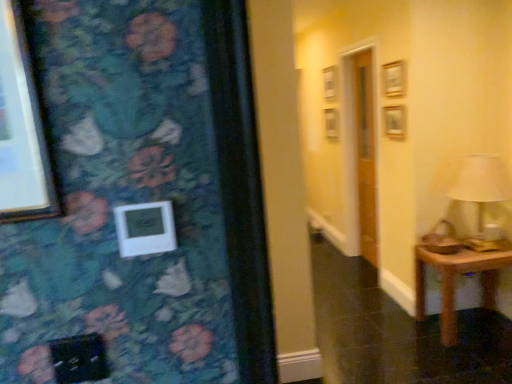
Question: From the image's perspective, relative to brown wooden table at lower right, is white plastic picture frame at center above or below?

Choices:
 (A) below
 (B) above

Answer: (B)

Question: Is point (130, 206) closer or farther from the camera than point (415, 266)?

Choices:
 (A) farther
 (B) closer

Answer: (B)

Question: Estimate the real-world distances between objects in this image. Which object is farther from the white plastic picture frame at center?

Choices:
 (A) brown wooden table at lower right
 (B) white fabric lampshade at right

Answer: (B)

Question: Based on their relative distances, which object is nearer to the white fabric lampshade at right?

Choices:
 (A) brown wooden table at lower right
 (B) white plastic picture frame at center

Answer: (A)